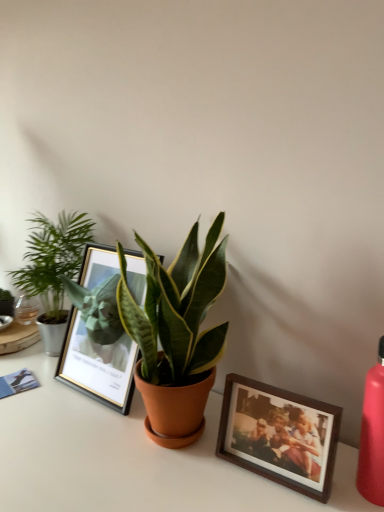
Locate an element on the screen. The image size is (384, 512). vacant point to the left of matte red bottle at right is located at coordinates (265, 484).